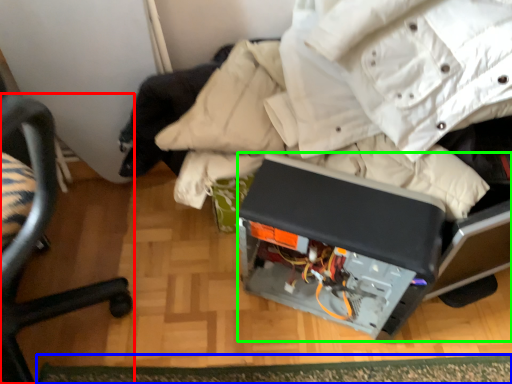
Question: Which is nearer to the chair (highlighted by a red box)? mat (highlighted by a blue box) or wide (highlighted by a green box).

Choices:
 (A) mat
 (B) wide

Answer: (A)